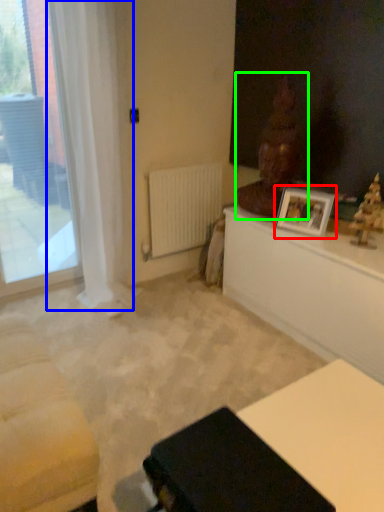
Question: Based on their relative distances, which object is farther from picture frame (highlighted by a red box)? Choose from curtain (highlighted by a blue box) and sculpture (highlighted by a green box).

Choices:
 (A) curtain
 (B) sculpture

Answer: (A)